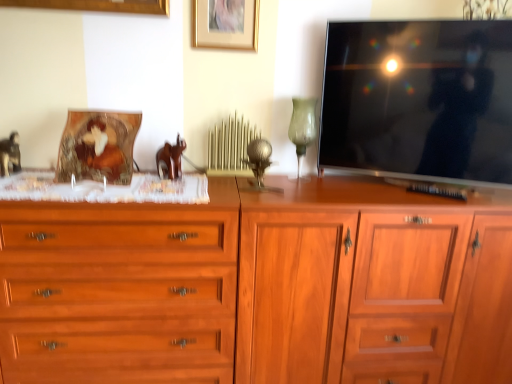
Find the location of a particular element. The height and width of the screenshot is (384, 512). free region on the left part of matte black tv at upper right is located at coordinates (343, 190).